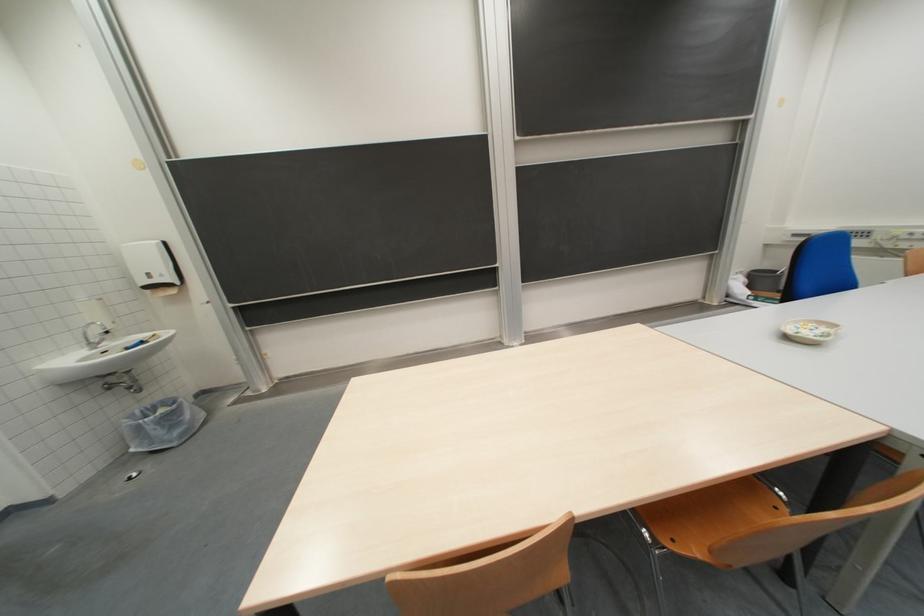
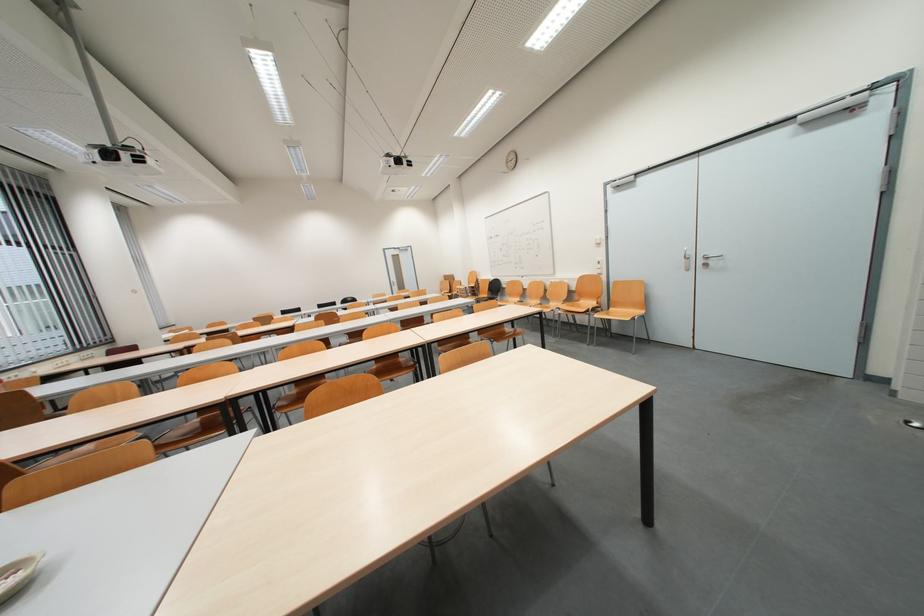
Question: I am providing you with two images of the same scene from different viewpoints. After the viewpoint changes to image2, which objects are now occluded?

Choices:
 (A) door handle
 (B) gray laundry hamper
 (C) small white bowl
 (D) chair sitting surface

Answer: (D)